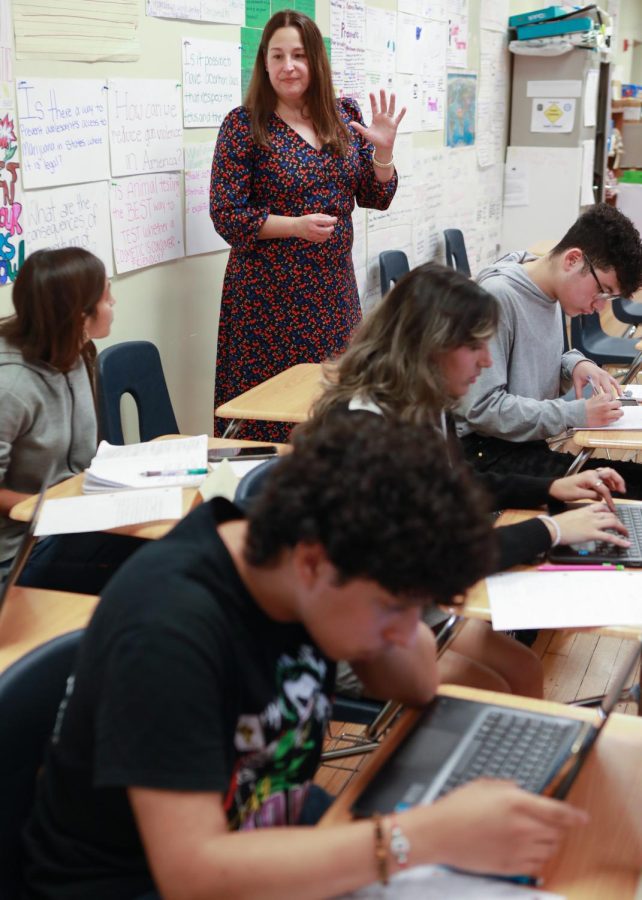
Identify the location of laptops. (531, 726), (629, 536).